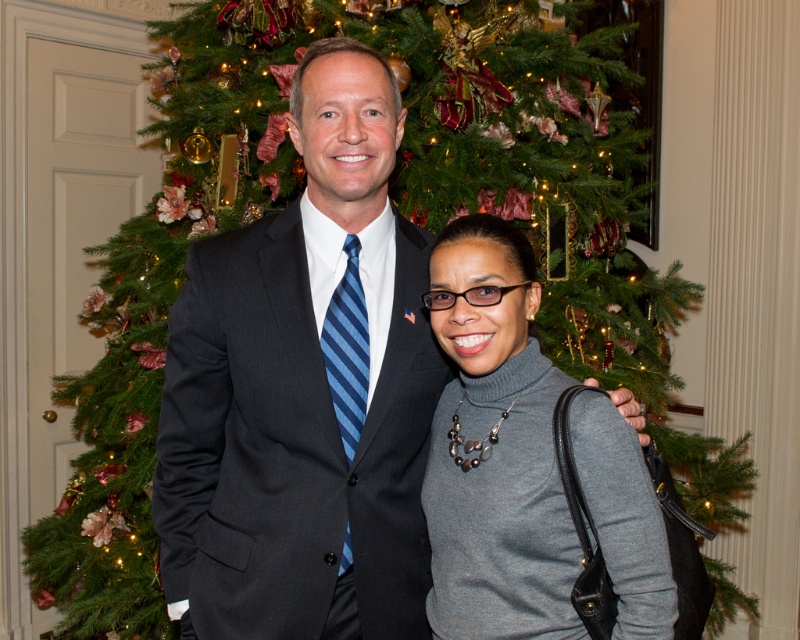
You are standing at the point marked as point (350, 632) and want to move towards the Christmas tree in the background. Is there enough space to walk straight ahead without hitting either the man on the left or the woman on the right?

The distance between the two people is 4.71 feet, so there is enough space to walk straight ahead between them towards the Christmas tree.

You are a photographer setting up for a group photo. You need to ensure that the dark gray suit at center and the gray matte turtleneck sweater at center are both clearly visible in the frame. Which clothing item should you focus on first to ensure proper exposure, considering their sizes?

The dark gray suit at center has a larger size compared to the gray matte turtleneck sweater at center. Therefore, focusing on the dark gray suit at center first will ensure proper exposure since it occupies more space in the frame.